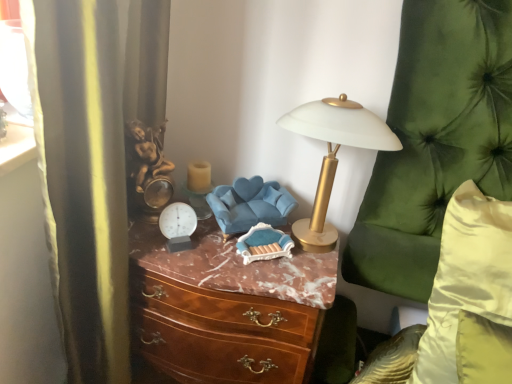
I want to click on blank space situated above marble/wooden chest of drawers at center (from a real-world perspective), so click(247, 259).